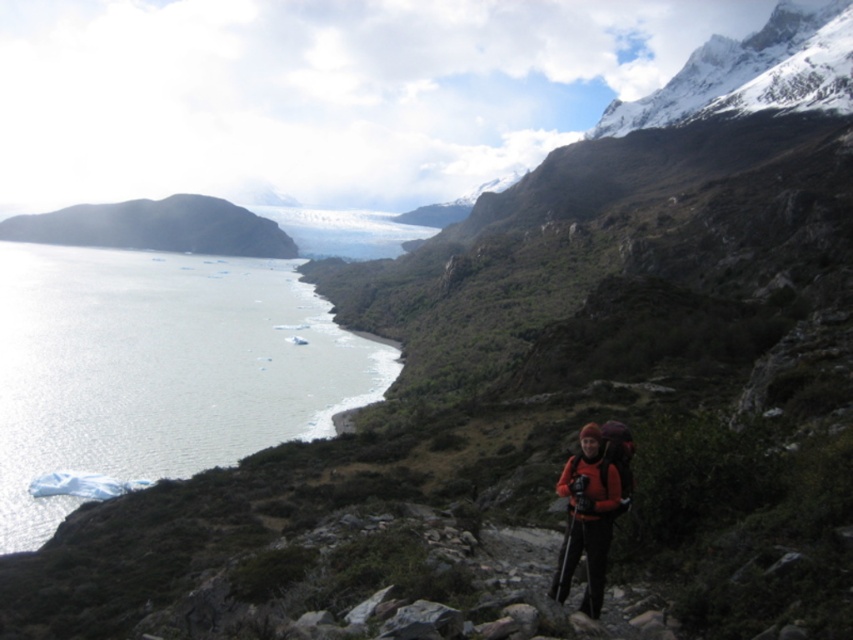
You are a hiker trying to cross the clear water at left. There is an orange fleece jacket at center. Which object is closer to you as you approach the water?

The clear water at left is closer to you since the orange fleece jacket at center is behind it.